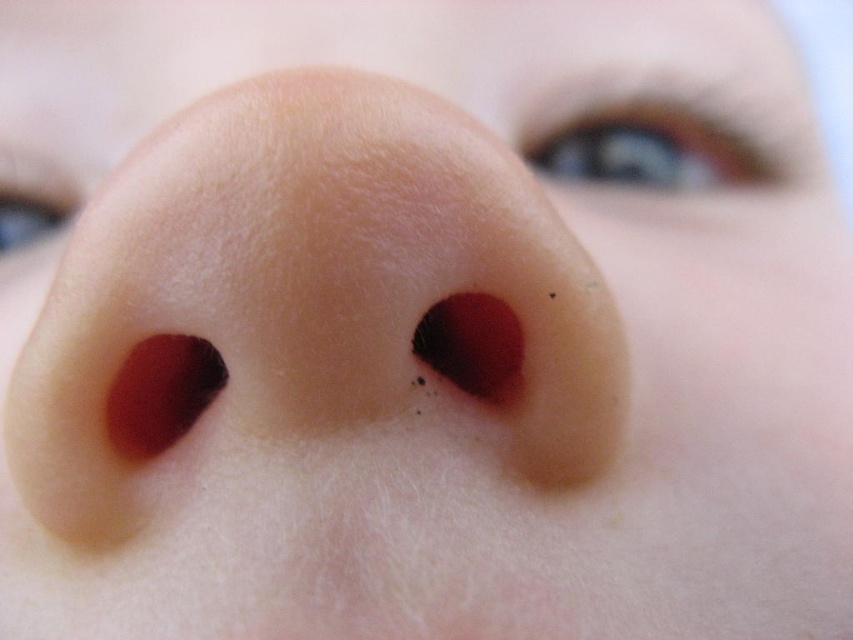
Based on the image description, where is the blue glossy eye at upper center located in terms of coordinates?

The blue glossy eye at upper center is located at coordinates point (647, 145).

You are a photographer who wants to capture a closeup of the blue glossy eye at upper center and the matte blue eye at upper left. Given their height difference, which eye should you focus on to ensure both are in frame without cropping?

The blue glossy eye at upper center is much taller than the matte blue eye at upper left, so focusing on the blue glossy eye at upper center would ensure both eyes are in frame without cropping since it requires more vertical space.

You are a photographer trying to capture a closeup of the blue glossy eye at upper center. You are currently 34.26 inches away from the camera. Is this distance suitable for a detailed closeup shot?

The blue glossy eye at upper center and camera are 34.26 inches apart, so this distance is suitable for a detailed closeup shot.